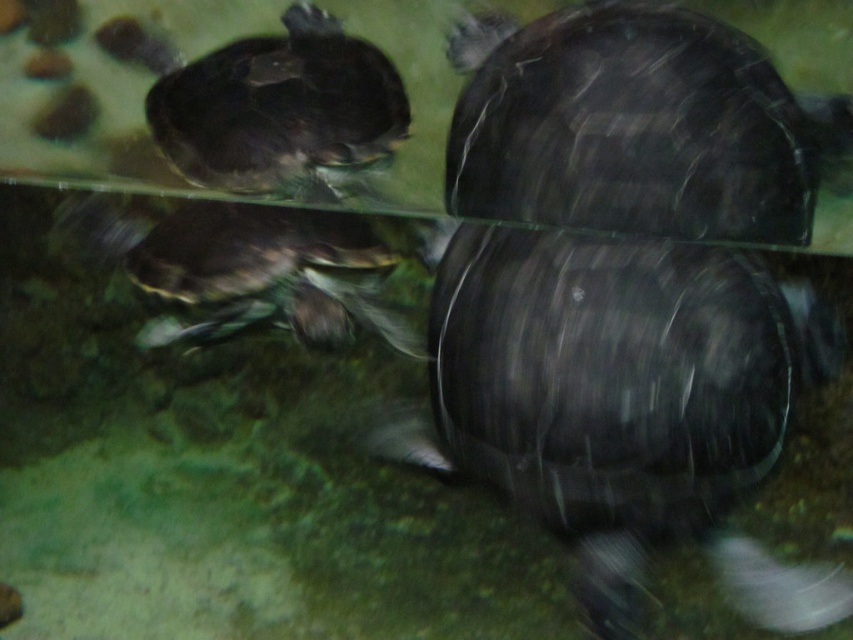
You are a researcher studying turtle behavior in an aquarium. You observe a shiny black tortoise at center marked by point (624, 403). Can you determine if the tortoise is closer to the front or back of the aquarium based on its position?

The shiny black tortoise at center is represented by point (624, 403), which is at the center of the aquarium, so it is equidistant from the front and back.

You are a researcher analyzing the positioning of the shiny black tortoise at upper center in the aquarium. What are the coordinates of its 2D location?

The coordinates of the shiny black tortoise at upper center are at point [282,113].